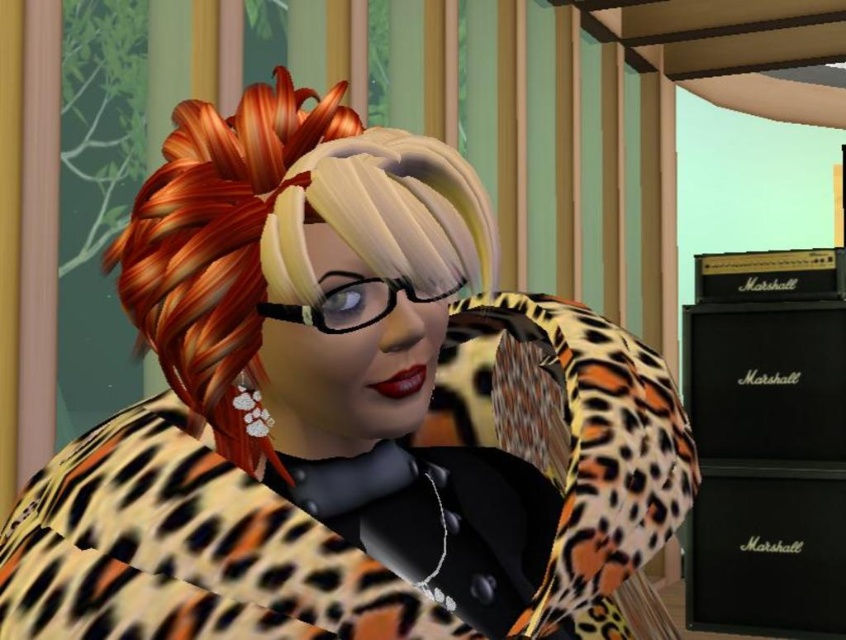
Who is more distant from viewer, (564, 394) or (262, 236)?

Positioned behind is point (564, 394).

Between leopard print coat at center and leopard print hair at center, which one is positioned higher?

leopard print hair at center is higher up.

Which is in front, point (470, 589) or point (454, 182)?

Point (454, 182) is more forward.

Where is `leopard print coat at center`? This screenshot has width=846, height=640. leopard print coat at center is located at coordinates (336, 412).